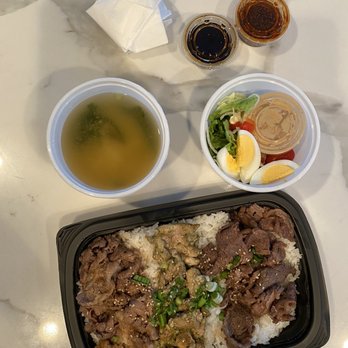
Image resolution: width=348 pixels, height=348 pixels. What are the coordinates of `bowl` in the screenshot? It's located at (311, 133).